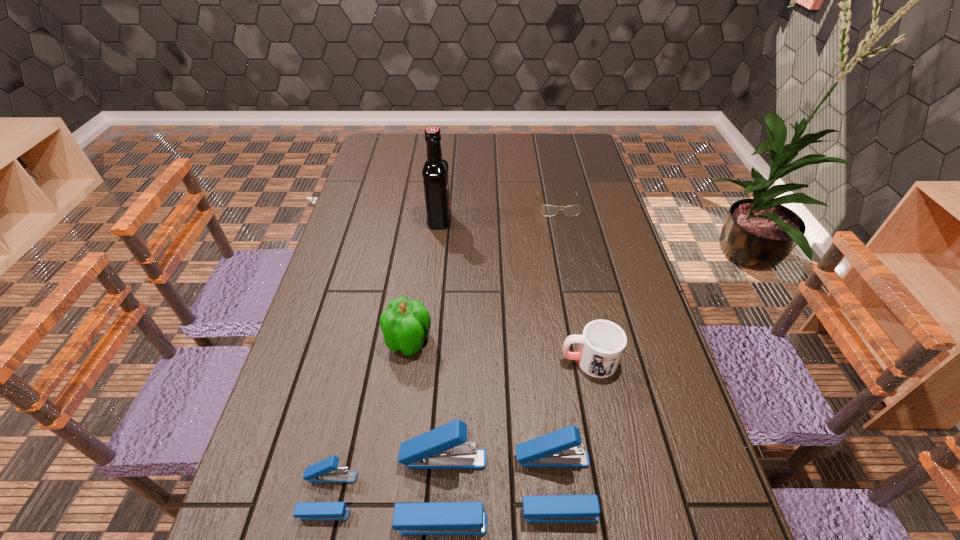
Please point a spot on the right to add another stapler. Please provide its 2D coordinates. Your answer should be formatted as a tuple, i.e. [(x, y)], where the tuple contains the x and y coordinates of a point satisfying the conditions above.

[(666, 481)]